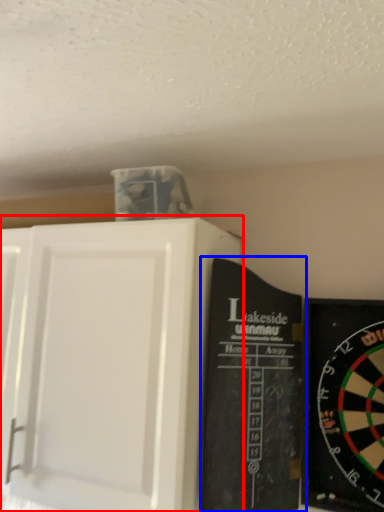
Question: Which object is closer to the camera taking this photo, cupboard (highlighted by a red box) or bulletin board (highlighted by a blue box)?

Choices:
 (A) cupboard
 (B) bulletin board

Answer: (B)